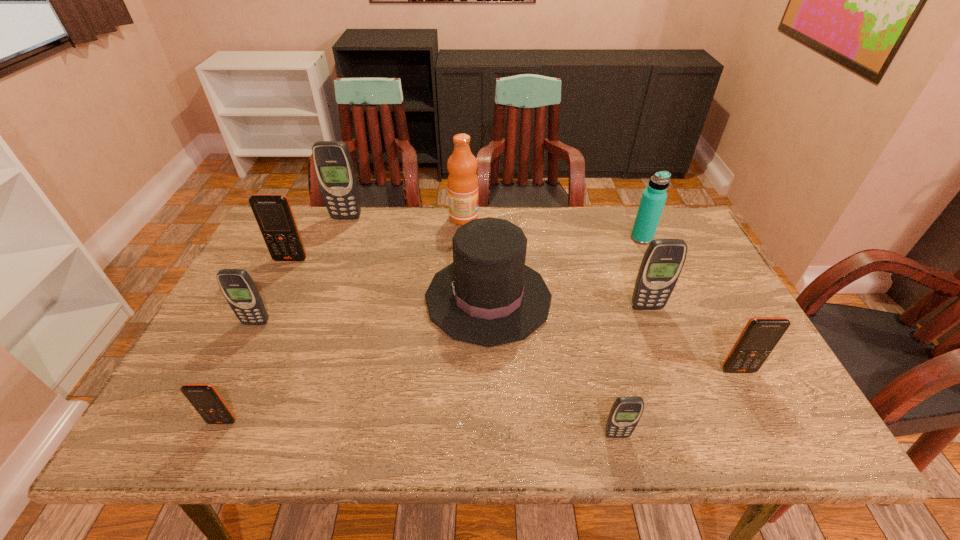
At what (x,y) coordinates should I click in order to perform the action: click on fruit juice. Please return your answer as a coordinate pair (x, y). This screenshot has height=540, width=960. Looking at the image, I should click on (462, 165).

Find the location of a particular element. This screenshot has height=540, width=960. the farthest gray cellular telephone is located at coordinates (334, 168).

This screenshot has height=540, width=960. I want to click on the fourth cellular telephone from left to right, so 334,168.

You are a GUI agent. You are given a task and a screenshot of the screen. Output one action in this format:
    pyautogui.click(x=<x>, y=<y>)
    Task: Click on the eighth nearest object
    
    Given the screenshot: What is the action you would take?
    pyautogui.click(x=653, y=199)

Find the location of a particular element. This screenshot has height=540, width=960. blue water bottle is located at coordinates (653, 199).

The width and height of the screenshot is (960, 540). In order to click on the farthest orange cellular telephone in this screenshot , I will do `click(273, 213)`.

The width and height of the screenshot is (960, 540). In order to click on the sixth nearest cellular telephone in this screenshot , I will do `click(273, 213)`.

You are a GUI agent. You are given a task and a screenshot of the screen. Output one action in this format:
    pyautogui.click(x=<x>, y=<y>)
    Task: Click on the second cellular telephone from right to left
    
    Given the screenshot: What is the action you would take?
    pyautogui.click(x=662, y=263)

This screenshot has width=960, height=540. Identify the location of the rightmost gray cellular telephone. (662, 263).

Identify the location of dress hat. The width and height of the screenshot is (960, 540). (488, 296).